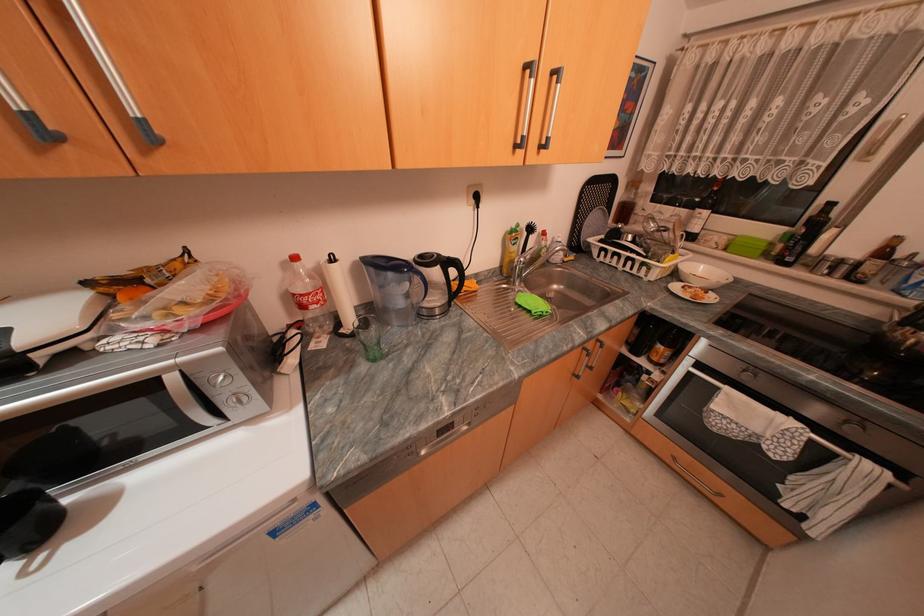
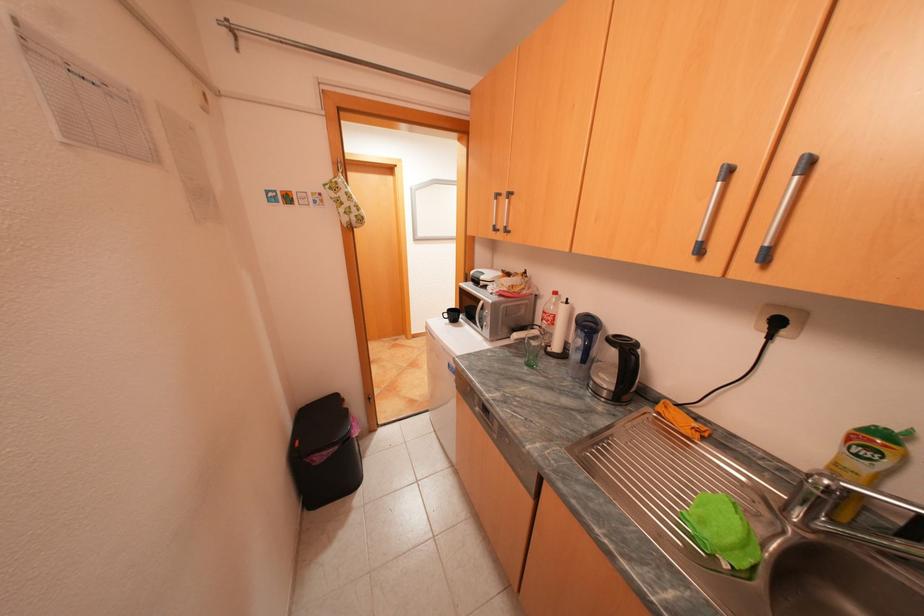
In the second image, find the point that corresponds to the point at 311,294 in the first image.

(553, 312)